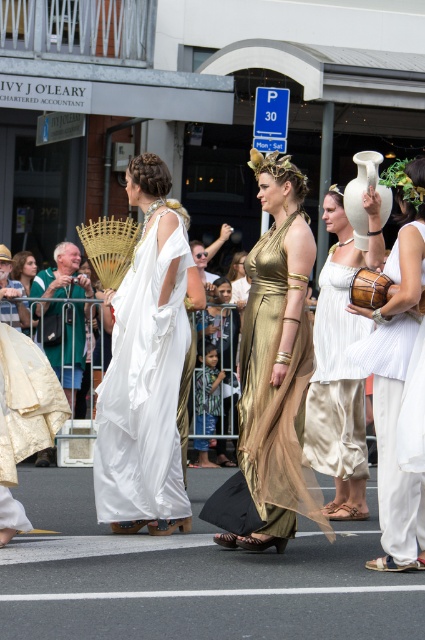
Question: Estimate the real-world distances between objects in this image. Which object is closer to the metallic gold dress at center?

Choices:
 (A) white silk dress at center
 (B) white matte vase at right
 (C) gold metallic dress at center

Answer: (C)

Question: Which point is farther from the camera taking this photo?

Choices:
 (A) (362, 253)
 (B) (416, 168)
 (C) (42, 433)
 (D) (152, 298)

Answer: (A)

Question: Can you confirm if white silk toga at center is thinner than white silk dress at center?

Choices:
 (A) no
 (B) yes

Answer: (A)

Question: Based on their relative distances, which object is farther from the white matte vase at right?

Choices:
 (A) white silk toga at center
 (B) gold metallic dress at center
 (C) white silk dress at center

Answer: (C)

Question: Can you confirm if white silk toga at center is positioned to the right of white silk dress at center?

Choices:
 (A) yes
 (B) no

Answer: (B)

Question: Can you confirm if white matte vase at right is positioned above white silk toga at lower left?

Choices:
 (A) yes
 (B) no

Answer: (A)